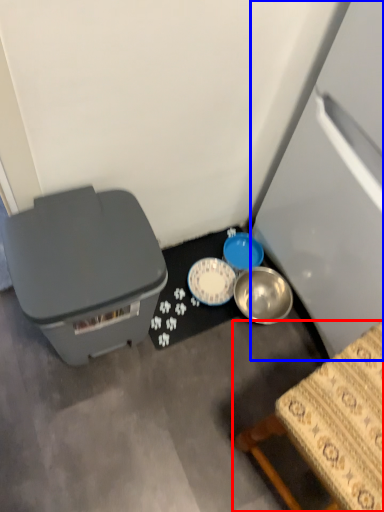
Question: Which point is further to the camera, furniture (highlighted by a red box) or refrigerator (highlighted by a blue box)?

Choices:
 (A) furniture
 (B) refrigerator

Answer: (A)